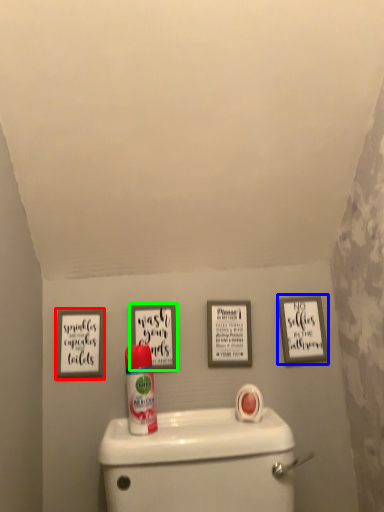
Question: Estimate the real-world distances between objects in this image. Which object is farther from picture frame (highlighted by a red box), picture frame (highlighted by a blue box) or picture frame (highlighted by a green box)?

Choices:
 (A) picture frame
 (B) picture frame

Answer: (A)